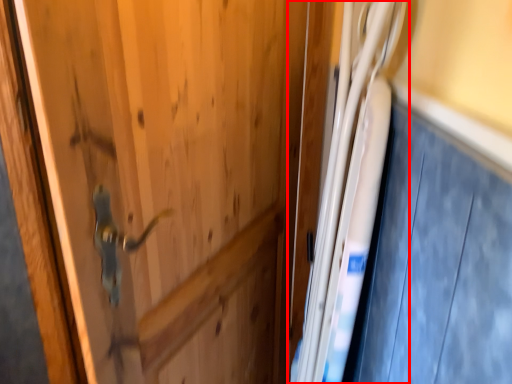
Question: From the image's perspective, where is fridge (annotated by the red box) located relative to car door?

Choices:
 (A) above
 (B) below

Answer: (B)